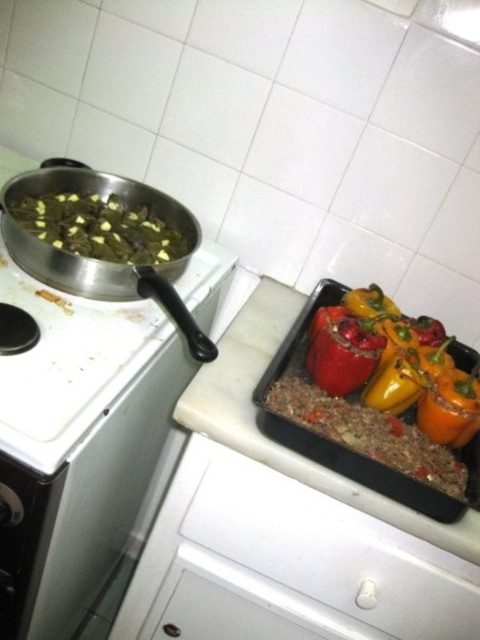
Question: Can you confirm if white plastic drawer at lower center is positioned to the left of green matte vegetables at left?

Choices:
 (A) no
 (B) yes

Answer: (A)

Question: Is white plastic drawer at lower center positioned behind smooth orange bell pepper at right?

Choices:
 (A) yes
 (B) no

Answer: (B)

Question: Which object appears farthest from the camera in this image?

Choices:
 (A) green matte vegetables at left
 (B) smooth orange bell pepper at right

Answer: (A)

Question: Which of the following is the closest to the observer?

Choices:
 (A) 388,540
 (B) 408,378
 (C) 140,259

Answer: (A)

Question: Observing the image, what is the correct spatial positioning of white plastic drawer at lower center in reference to green matte vegetables at left?

Choices:
 (A) left
 (B) right

Answer: (B)

Question: Which object is closer to the camera taking this photo?

Choices:
 (A) white plastic drawer at lower center
 (B) green matte vegetables at left
 (C) smooth orange bell pepper at right

Answer: (A)